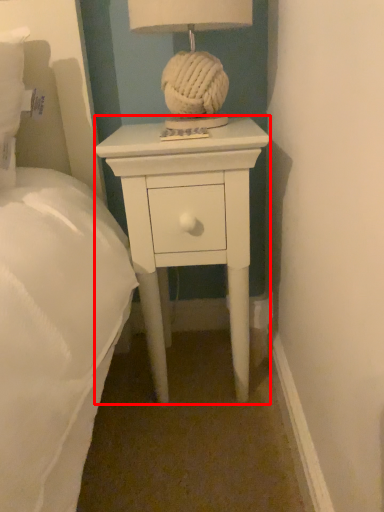
Question: From the image's perspective, where is nightstand (annotated by the red box) located relative to table lamp?

Choices:
 (A) below
 (B) above

Answer: (A)